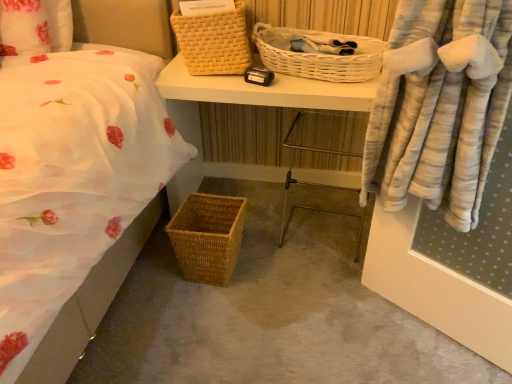
Image resolution: width=512 pixels, height=384 pixels. I want to click on vacant area that is in front of metal frame chair at center, so click(317, 284).